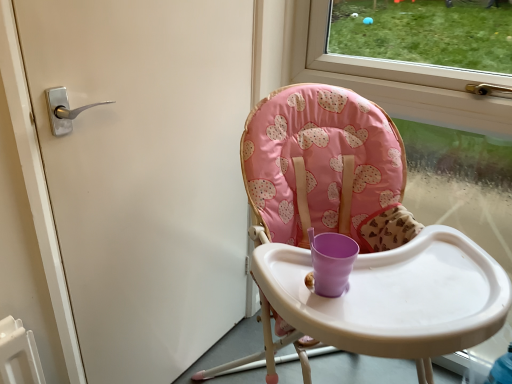
Question: From a real-world perspective, is matte silver handle at left above or below pink fabric highchair at center?

Choices:
 (A) below
 (B) above

Answer: (B)

Question: From their relative heights in the image, would you say matte silver handle at left is taller or shorter than pink fabric highchair at center?

Choices:
 (A) short
 (B) tall

Answer: (B)

Question: From the image's perspective, is matte silver handle at left above or below pink fabric highchair at center?

Choices:
 (A) above
 (B) below

Answer: (A)

Question: From a real-world perspective, is pink fabric highchair at center positioned above or below matte silver handle at left?

Choices:
 (A) above
 (B) below

Answer: (B)

Question: Is pink fabric highchair at center inside the boundaries of matte silver handle at left, or outside?

Choices:
 (A) inside
 (B) outside

Answer: (B)

Question: Is pink fabric highchair at center to the left or to the right of matte silver handle at left in the image?

Choices:
 (A) right
 (B) left

Answer: (A)

Question: Is pink fabric highchair at center bigger or smaller than matte silver handle at left?

Choices:
 (A) big
 (B) small

Answer: (A)